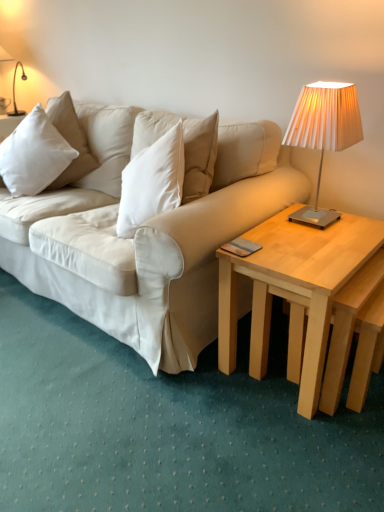
Question: Is white soft pillow at left wider or thinner than light wood/natural wood coffee table at right?

Choices:
 (A) wide
 (B) thin

Answer: (B)

Question: In the image, is white soft pillow at left on the left side or the right side of light wood/natural wood coffee table at right?

Choices:
 (A) right
 (B) left

Answer: (B)

Question: Considering the real-world distances, which object is farthest from the metallic pleated lampshade at upper right?

Choices:
 (A) white soft pillow at left
 (B) light wood/natural wood coffee table at right

Answer: (A)

Question: Which is nearer to the metallic pleated lampshade at upper right?

Choices:
 (A) white soft pillow at left
 (B) light wood/natural wood coffee table at right

Answer: (B)